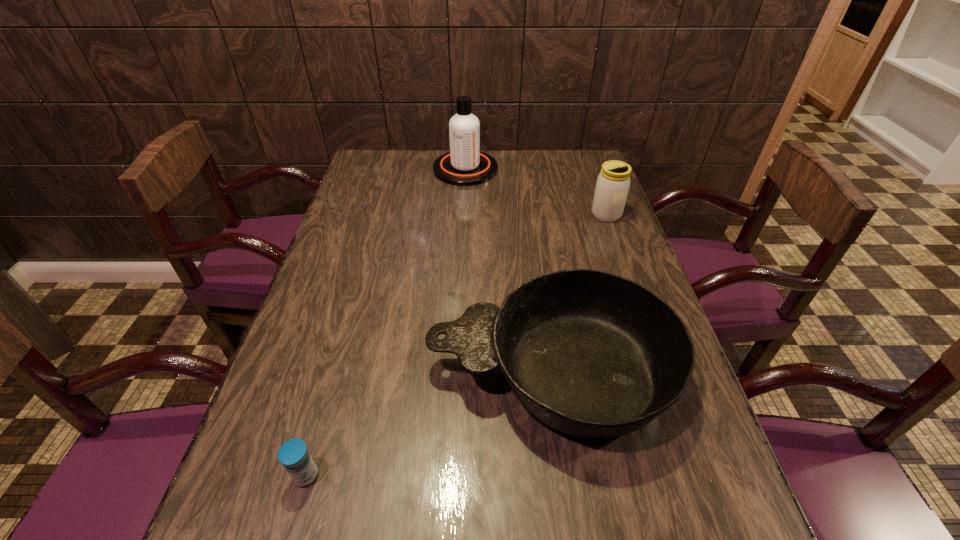
This screenshot has height=540, width=960. I want to click on the tallest object, so click(x=464, y=165).

In order to click on the farthest object in this screenshot , I will do `click(464, 165)`.

This screenshot has width=960, height=540. I want to click on jar, so click(x=613, y=182).

This screenshot has height=540, width=960. Find the location of `the second farthest object`. the second farthest object is located at coordinates (613, 182).

Locate an element on the screen. the third farthest object is located at coordinates (591, 354).

Where is `the third tallest object`? the third tallest object is located at coordinates (591, 354).

This screenshot has height=540, width=960. Identify the location of the shortest object. (293, 454).

The image size is (960, 540). I want to click on the leftmost object, so click(293, 454).

Find the location of a particular element. vacant space located 0.170m on the front of the cleansing agent is located at coordinates (464, 215).

Where is `vacant space located 0.250m on the front of the jar`? This screenshot has width=960, height=540. vacant space located 0.250m on the front of the jar is located at coordinates (630, 280).